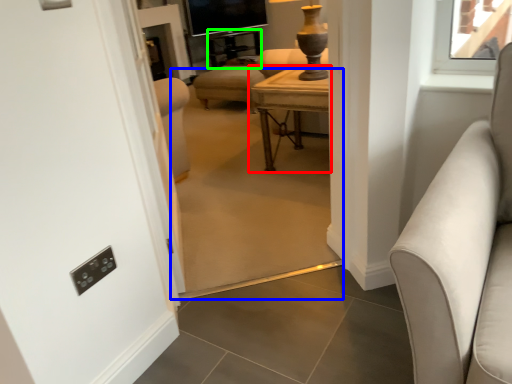
Question: Based on their relative distances, which object is nearer to table (highlighted by a red box)? Choose from plain (highlighted by a blue box) and side table (highlighted by a green box).

Choices:
 (A) plain
 (B) side table

Answer: (A)